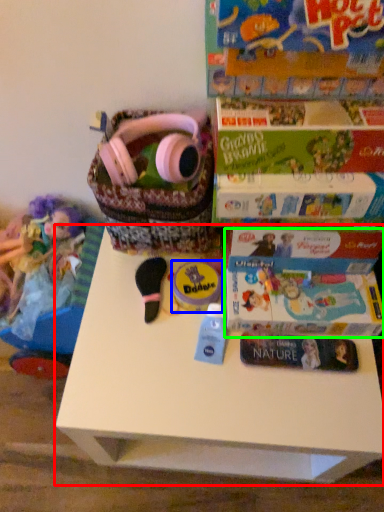
Question: Based on their relative distances, which object is nearer to table (highlighted by a red box)? Choose from toy (highlighted by a blue box) and paperback book (highlighted by a green box).

Choices:
 (A) toy
 (B) paperback book

Answer: (B)